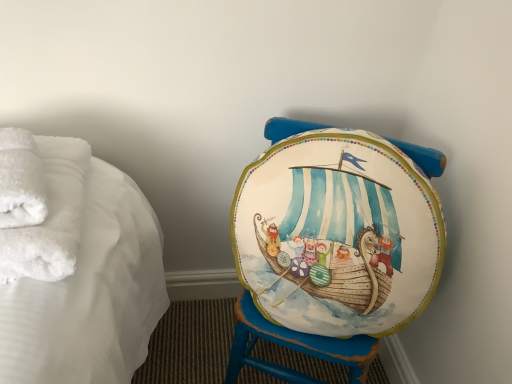
Question: Are matte painted stool at center and white fluffy towels at left, the 1th bath towel positioned from the back, far apart?

Choices:
 (A) no
 (B) yes

Answer: (A)

Question: From the image's perspective, is matte painted stool at center beneath white fluffy towels at left, the 2th bath towel positioned from the front?

Choices:
 (A) yes
 (B) no

Answer: (A)

Question: Is matte painted stool at center smaller than white fluffy towels at left, the 1th bath towel positioned from the back?

Choices:
 (A) no
 (B) yes

Answer: (A)

Question: Is the depth of matte painted stool at center greater than that of white fluffy towels at left, the 2th bath towel positioned from the front?

Choices:
 (A) no
 (B) yes

Answer: (B)

Question: Considering the relative sizes of matte painted stool at center and white fluffy towels at left, the 1th bath towel positioned from the back, in the image provided, is matte painted stool at center taller than white fluffy towels at left, the 1th bath towel positioned from the back,?

Choices:
 (A) yes
 (B) no

Answer: (A)

Question: Considering the relative positions of matte painted stool at center and white fluffy towels at left, the 1th bath towel positioned from the back, in the image provided, is matte painted stool at center to the left of white fluffy towels at left, the 1th bath towel positioned from the back, from the viewer's perspective?

Choices:
 (A) yes
 (B) no

Answer: (B)

Question: From a real-world perspective, is white fluffy bath towel at left, marked as the 1th bath towel in a front-to-back arrangement, under matte painted stool at center?

Choices:
 (A) no
 (B) yes

Answer: (A)

Question: Is white fluffy bath towel at left, marked as the 1th bath towel in a front-to-back arrangement, at the left side of matte painted stool at center?

Choices:
 (A) yes
 (B) no

Answer: (A)

Question: From the image's perspective, is white fluffy bath towel at left, marked as the 1th bath towel in a front-to-back arrangement, above matte painted stool at center?

Choices:
 (A) yes
 (B) no

Answer: (A)

Question: Can we say white fluffy bath towel at left, the 2th bath towel in the back-to-front sequence, lies outside matte painted stool at center?

Choices:
 (A) yes
 (B) no

Answer: (A)

Question: Considering the relative positions of white fluffy bath towel at left, marked as the 1th bath towel in a front-to-back arrangement, and matte painted stool at center in the image provided, is white fluffy bath towel at left, marked as the 1th bath towel in a front-to-back arrangement, to the right of matte painted stool at center from the viewer's perspective?

Choices:
 (A) yes
 (B) no

Answer: (B)

Question: Considering the relative sizes of white fluffy bath towel at left, the 2th bath towel in the back-to-front sequence, and matte painted stool at center in the image provided, is white fluffy bath towel at left, the 2th bath towel in the back-to-front sequence, taller than matte painted stool at center?

Choices:
 (A) no
 (B) yes

Answer: (A)

Question: Is white fluffy towels at left, the 1th bath towel positioned from the back, oriented away from matte painted stool at center?

Choices:
 (A) no
 (B) yes

Answer: (A)